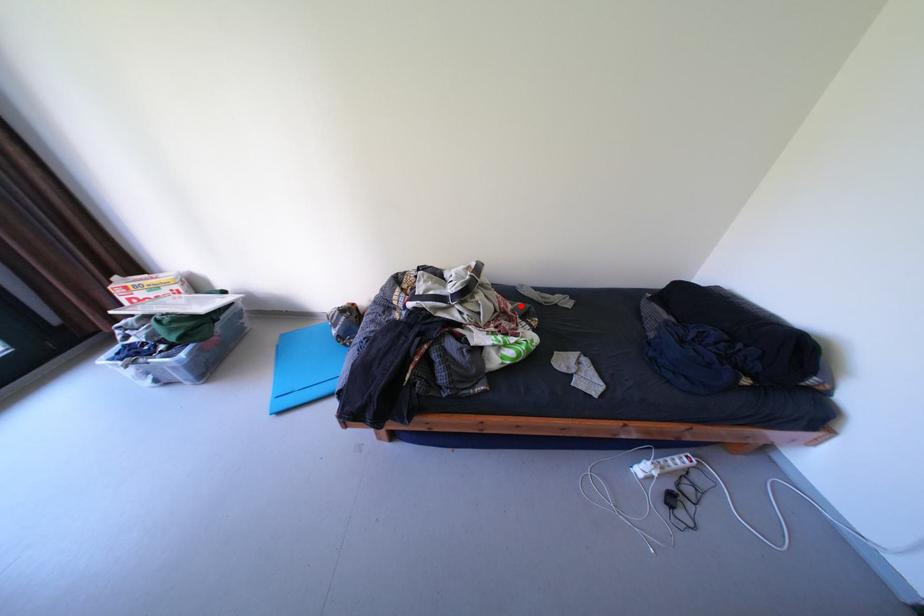
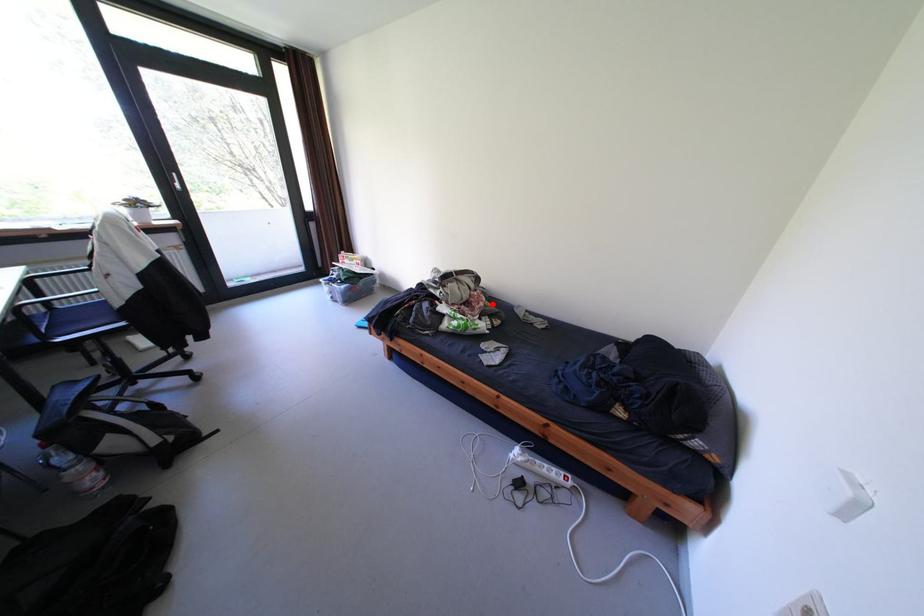
I am providing you with two images of the same scene from different viewpoints. A red point is marked on the first image and another point is marked on the second image. Is the red point in image1 aligned with the point shown in image2?

Yes